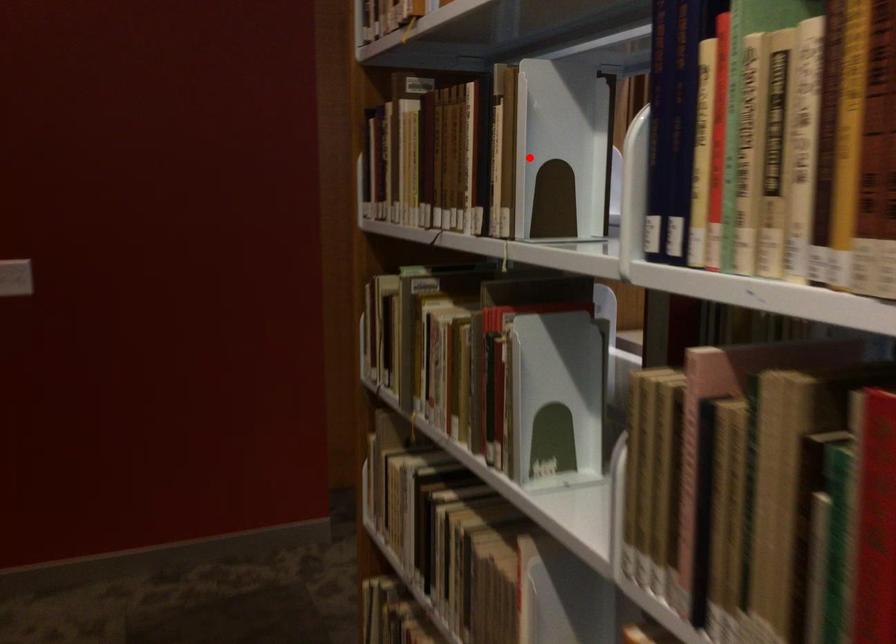
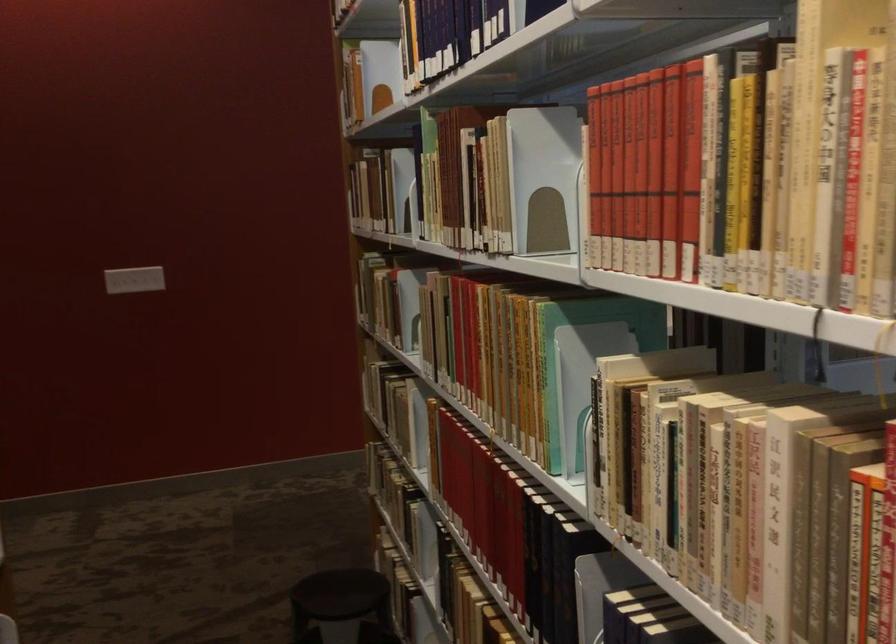
Find the pixel in the second image that matches the highlighted location in the first image.

(400, 190)